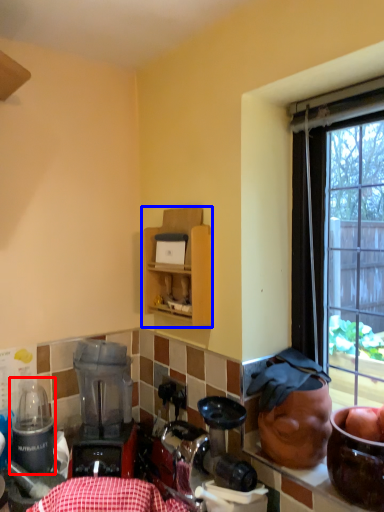
Question: Which object appears closest to the camera in this image, appliance (highlighted by a red box) or cabinetry (highlighted by a blue box)?

Choices:
 (A) appliance
 (B) cabinetry

Answer: (A)